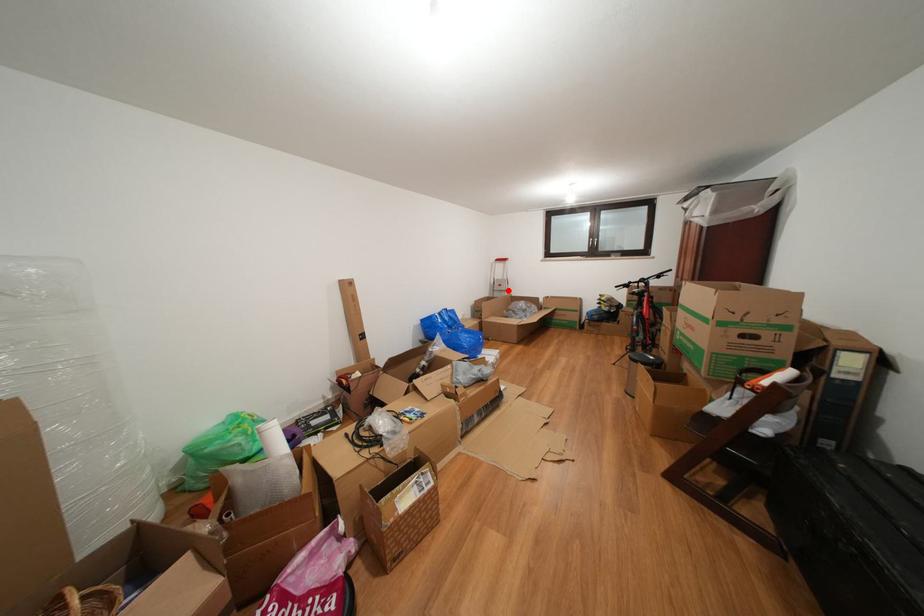
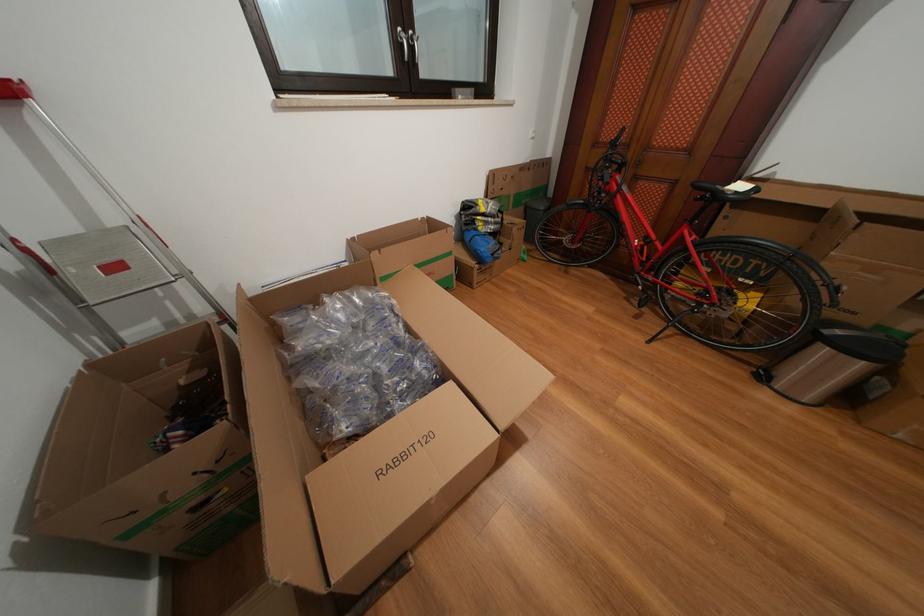
Question: I am providing you with two images of the same scene from different viewpoints. Given a red point in image1, look at the same physical point in image2. Is it:

Choices:
 (A) Closer to the viewpoint
 (B) Farther from the viewpoint

Answer: (B)